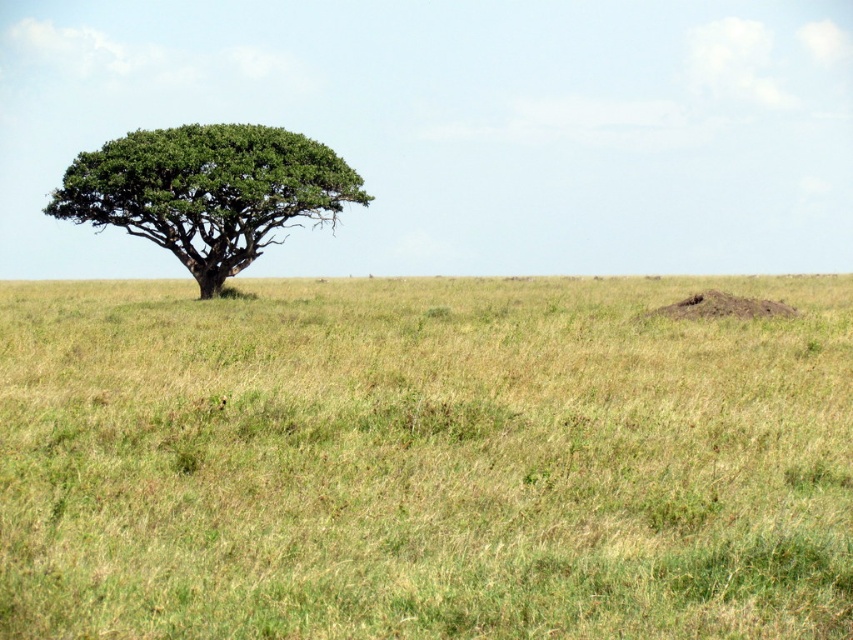
Question: Which of the following is the closest to the observer?

Choices:
 (A) (186, 227)
 (B) (750, 611)

Answer: (B)

Question: Which of the following is the closest to the observer?

Choices:
 (A) green leafy tree at left
 (B) green grass at center

Answer: (B)

Question: Can you confirm if green grass at center is bigger than green leafy tree at left?

Choices:
 (A) no
 (B) yes

Answer: (B)

Question: Does green grass at center have a smaller size compared to green leafy tree at left?

Choices:
 (A) no
 (B) yes

Answer: (A)

Question: In this image, where is green grass at center located relative to green leafy tree at left?

Choices:
 (A) below
 (B) above

Answer: (A)